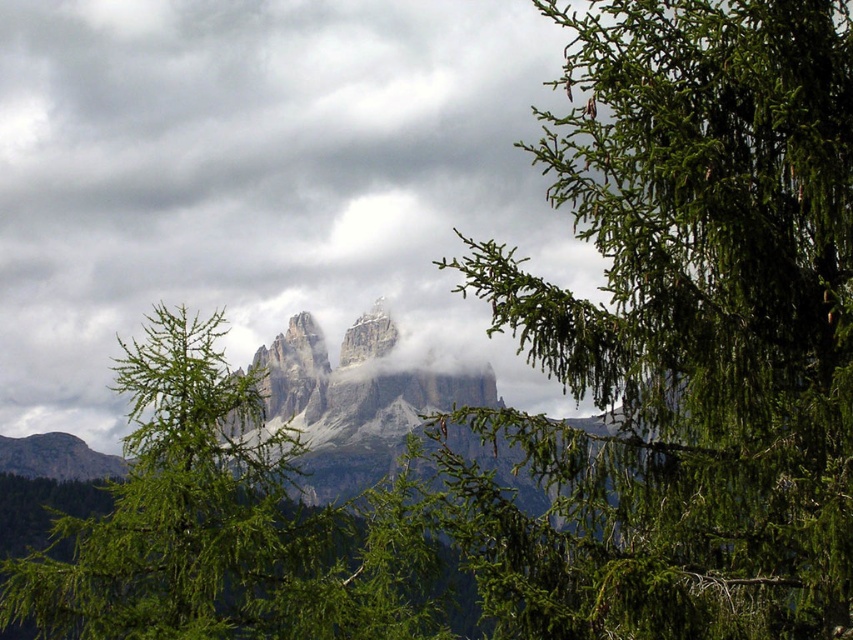
Is point (642, 122) closer to viewer compared to point (122, 356)?

Yes.

Does point (821, 420) lie behind point (212, 403)?

No, (821, 420) is closer to viewer.

Does point (781, 593) lie behind point (405, 554)?

No, it is not.

Identify the location of green needle-like branches at upper right. The image size is (853, 640). (683, 336).